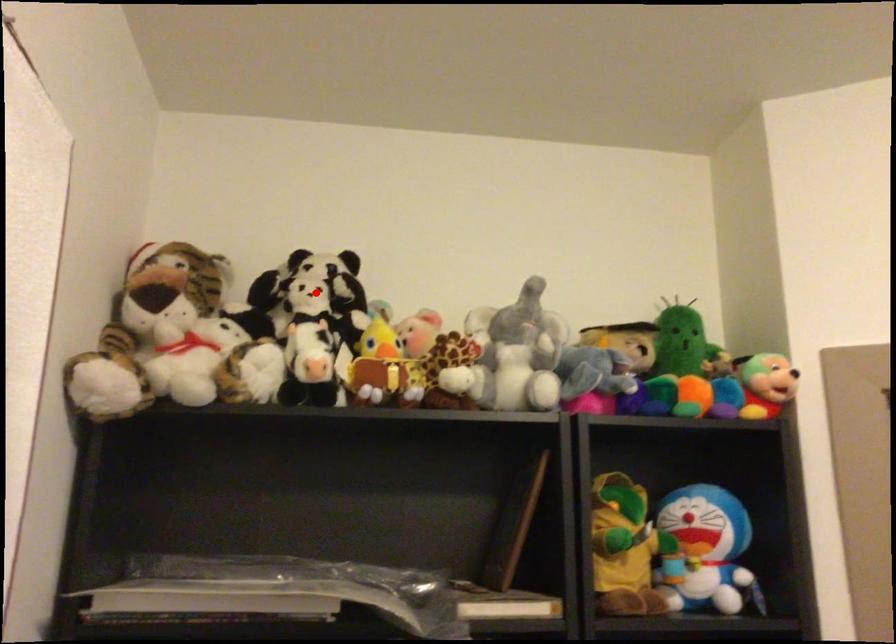
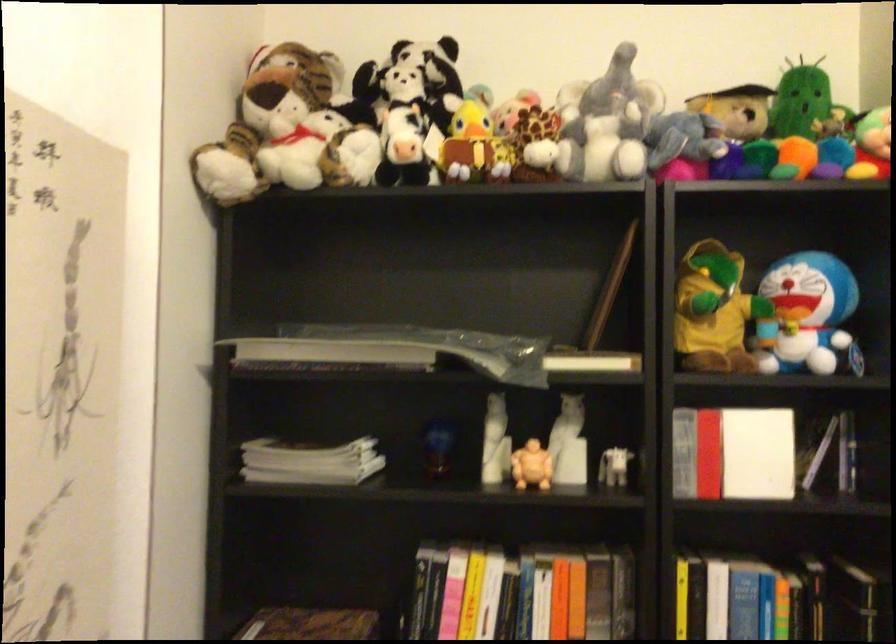
The point at the highlighted location is marked in the first image. Where is the corresponding point in the second image?

(410, 79)